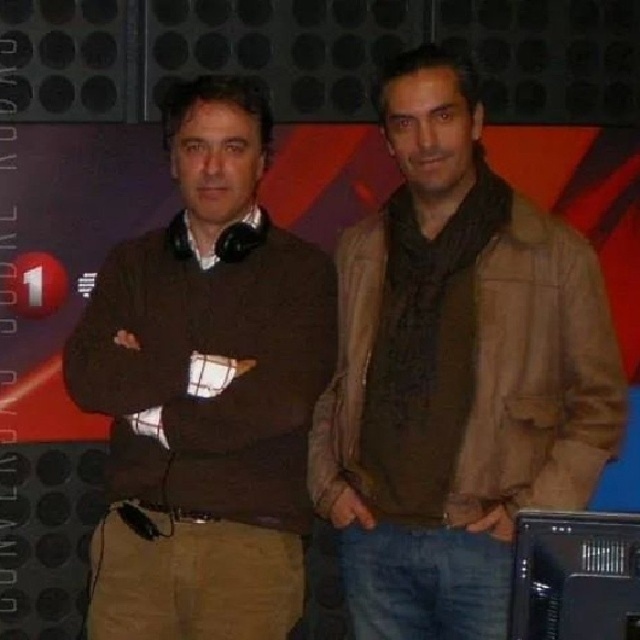
Between brown leather jacket at center and brown sweater at center, which one has more height?

With more height is brown leather jacket at center.

Does brown leather jacket at center appear under brown sweater at center?

No.

Does point (536, 241) lie behind point (288, 307)?

No, (536, 241) is closer to viewer.

Find the location of a particular element. brown leather jacket at center is located at coordinates (456, 372).